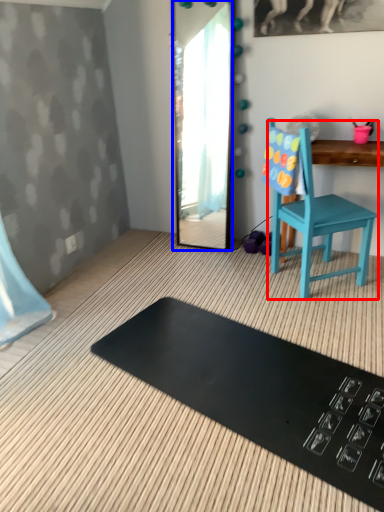
Question: Among these objects, which one is farthest to the camera, chair (highlighted by a red box) or mirror (highlighted by a blue box)?

Choices:
 (A) chair
 (B) mirror

Answer: (B)